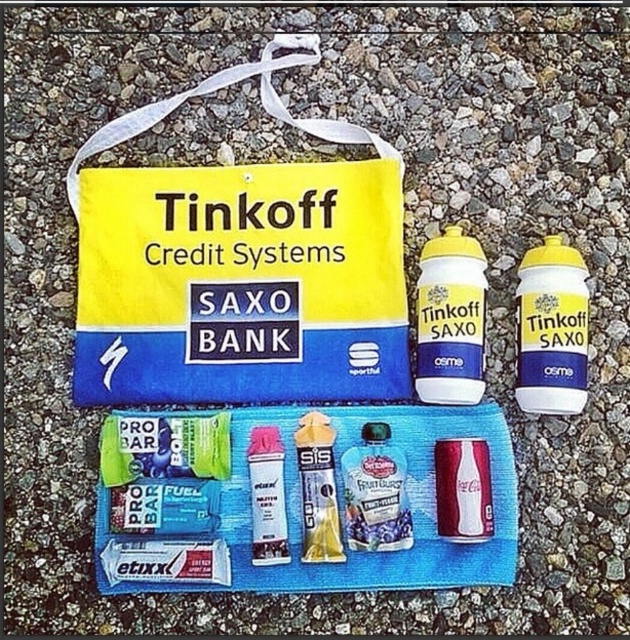
Does yellow matte water bottle at center have a lesser height compared to green matte bar at lower left?

No, yellow matte water bottle at center is not shorter than green matte bar at lower left.

Is point (472, 298) closer to camera compared to point (108, 465)?

No, it is not.

Identify the location of yellow matte water bottle at center. (450, 320).

Is yellow fabric bag at upper center to the right of yellow matte gel at center from the viewer's perspective?

Incorrect, yellow fabric bag at upper center is not on the right side of yellow matte gel at center.

Where is `yellow fabric bag at upper center`? Image resolution: width=630 pixels, height=640 pixels. yellow fabric bag at upper center is located at coordinates (241, 268).

This screenshot has width=630, height=640. I want to click on yellow fabric bag at upper center, so click(x=241, y=268).

Measure the distance between point (369, 364) and camera.

Point (369, 364) is 3.90 feet away from camera.

Which is behind, point (144, 195) or point (346, 532)?

Positioned behind is point (144, 195).

At what (x,y) coordinates should I click in order to perform the action: click on yellow fabric bag at upper center. Please return your answer as a coordinate pair (x, y). The width and height of the screenshot is (630, 640). Looking at the image, I should click on (241, 268).